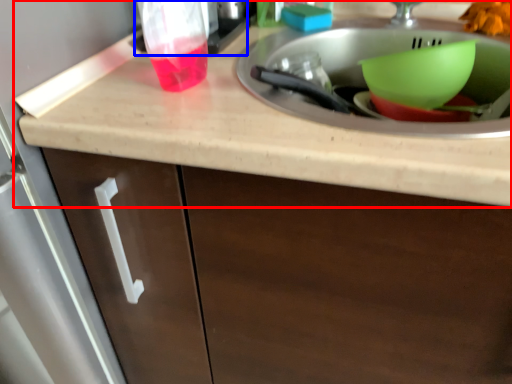
Question: Which point is closer to the camera, countertop (highlighted by a red box) or appliance (highlighted by a blue box)?

Choices:
 (A) countertop
 (B) appliance

Answer: (A)